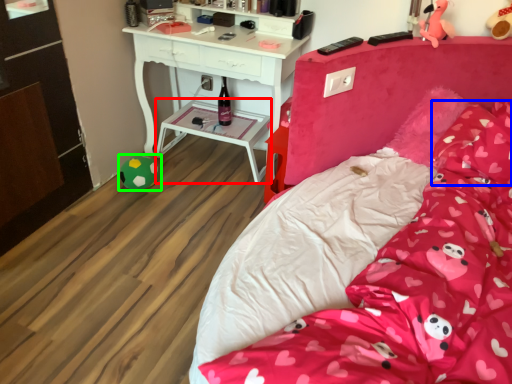
Question: Which object is positioned closest to side table (highlighted by a red box)? Select from pillow (highlighted by a blue box) and toy (highlighted by a green box).

Choices:
 (A) pillow
 (B) toy

Answer: (B)